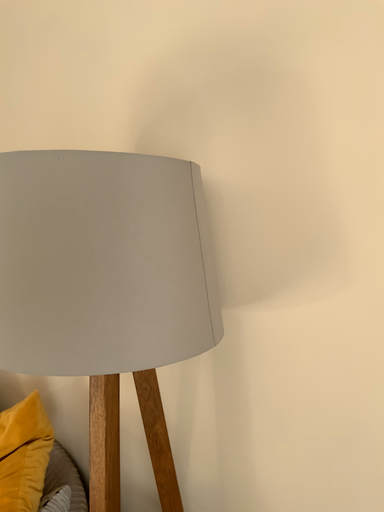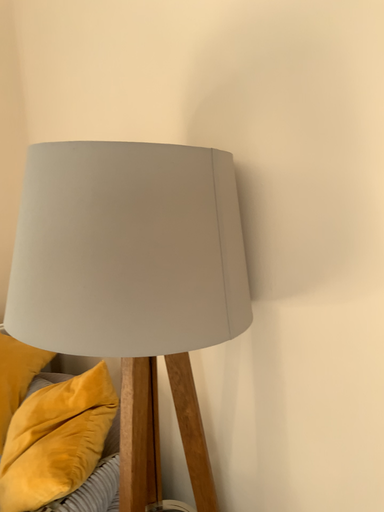
Question: Which way did the camera rotate in the video?

Choices:
 (A) rotated left
 (B) rotated right

Answer: (A)